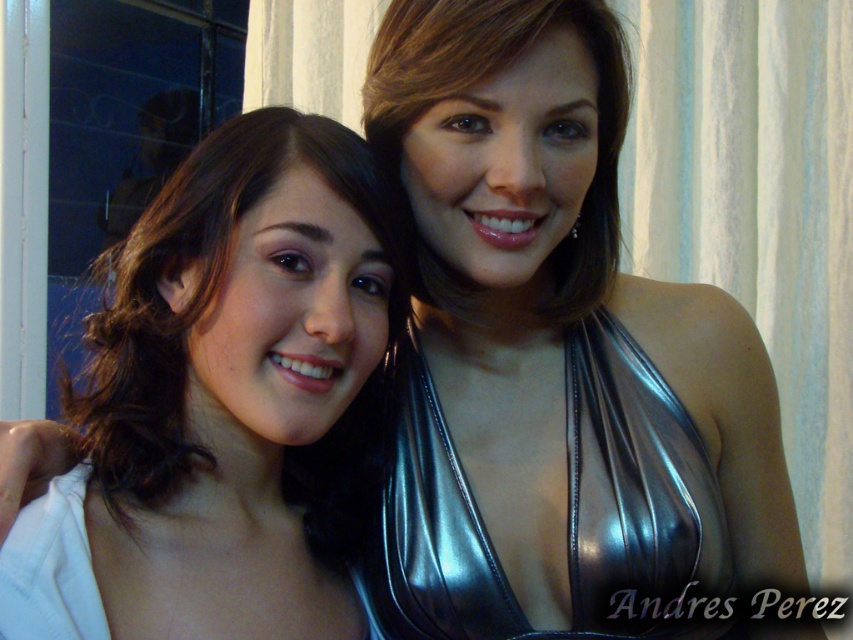
In the scene shown: Does matte black hair at center have a greater height compared to shiny black dress at center?

Yes, matte black hair at center is taller than shiny black dress at center.

Looking at this image, is matte black hair at center above shiny black dress at center?

Yes, matte black hair at center is above shiny black dress at center.

Is point (291, 161) closer to viewer compared to point (436, 515)?

Yes, it is.

Find the location of a particular element. This screenshot has height=640, width=853. matte black hair at center is located at coordinates (223, 404).